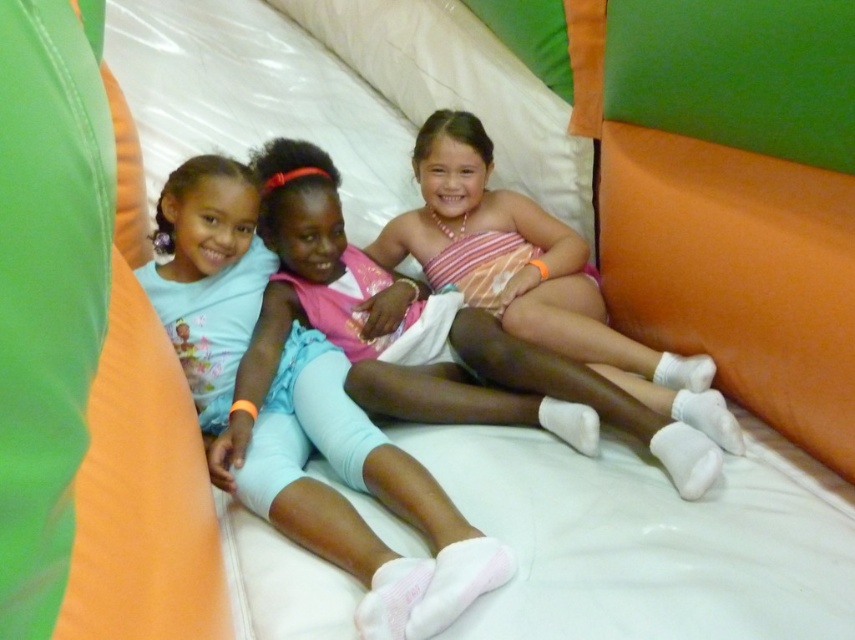
Looking at this image, is light blue fabric pants at center to the right of light blue leggings at center from the viewer's perspective?

Incorrect, light blue fabric pants at center is not on the right side of light blue leggings at center.

Does light blue fabric pants at center have a smaller size compared to light blue leggings at center?

No, light blue fabric pants at center is not smaller than light blue leggings at center.

The height and width of the screenshot is (640, 855). Describe the element at coordinates (363, 492) in the screenshot. I see `light blue fabric pants at center` at that location.

Where is `light blue fabric pants at center`? The height and width of the screenshot is (640, 855). light blue fabric pants at center is located at coordinates pyautogui.click(x=363, y=492).